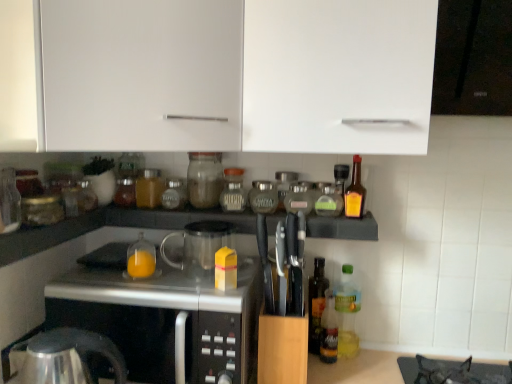
Image resolution: width=512 pixels, height=384 pixels. What do you see at coordinates (174, 195) in the screenshot? I see `translucent glass jar at center, positioned as the 8th bottle in right-to-left order` at bounding box center [174, 195].

The image size is (512, 384). I want to click on clear glass jar at left, positioned as the 2th bottle in left-to-right order, so click(86, 196).

What are the coordinates of `clear plastic bottle at lower right, the 2th bottle viewed from the right` in the screenshot? It's located at (347, 313).

What is the approximate height of white matte cabinet at upper center, the 3th cabinetry in the left-to-right sequence?

white matte cabinet at upper center, the 3th cabinetry in the left-to-right sequence, is 43.09 centimeters tall.

Where is `translucent glass bottle at center, which is counted as the 2th orange juice, starting from the front`? The height and width of the screenshot is (384, 512). translucent glass bottle at center, which is counted as the 2th orange juice, starting from the front is located at coordinates click(x=141, y=264).

Identify the location of translucent glass jar at center, positioned as the 8th bottle in right-to-left order. (174, 195).

Is translucent plastic carton at center, the second orange juice viewed from the back, a part of translucent glass jar at center, the 9th bottle in the right-to-left sequence?

No, translucent plastic carton at center, the second orange juice viewed from the back, is located outside of translucent glass jar at center, the 9th bottle in the right-to-left sequence.

Is translucent glass jar at center, the 9th bottle in the right-to-left sequence, facing away from translucent plastic carton at center, placed as the second orange juice when sorted from left to right?

That's not correct — translucent glass jar at center, the 9th bottle in the right-to-left sequence, is not looking away from translucent plastic carton at center, placed as the second orange juice when sorted from left to right.

Can you see translucent glass jar at center, positioned as the 4th bottle in left-to-right order, touching translucent plastic carton at center, the second orange juice viewed from the back?

There is a gap between translucent glass jar at center, positioned as the 4th bottle in left-to-right order, and translucent plastic carton at center, the second orange juice viewed from the back.

From a real-world perspective, is translucent glass jar at center, the 9th bottle in the right-to-left sequence, above or below translucent plastic carton at center, which appears as the first orange juice when viewed from the right?

In terms of real-world spatial position, translucent glass jar at center, the 9th bottle in the right-to-left sequence, is above translucent plastic carton at center, which appears as the first orange juice when viewed from the right.

From the image's perspective, is translucent glass jar at center, the 9th bottle in the right-to-left sequence, above shiny metallic kettle at lower left?

Yes, from the image's perspective, translucent glass jar at center, the 9th bottle in the right-to-left sequence, is over shiny metallic kettle at lower left.

Does translucent glass jar at center, the 9th bottle in the right-to-left sequence, lie in front of shiny metallic kettle at lower left?

That is False.

From a real-world perspective, which is physically below, translucent glass jar at center, the 9th bottle in the right-to-left sequence, or shiny metallic kettle at lower left?

shiny metallic kettle at lower left.

Does translucent glass jar at center, the 9th bottle in the right-to-left sequence, touch shiny metallic kettle at lower left?

No, translucent glass jar at center, the 9th bottle in the right-to-left sequence, is not touching shiny metallic kettle at lower left.

Choose the correct answer: Is transparent glass jar at center, the seventh bottle when ordered from right to left, inside amber glass bottle at right, which appears as the 1th bottle when viewed from the right, or outside it?

transparent glass jar at center, the seventh bottle when ordered from right to left, is not inside amber glass bottle at right, which appears as the 1th bottle when viewed from the right, it's outside.

Is amber glass bottle at right, arranged as the twelfth bottle when viewed from the left, at the back of transparent glass jar at center, the sixth bottle positioned from the left?

transparent glass jar at center, the sixth bottle positioned from the left, is not turned away from amber glass bottle at right, arranged as the twelfth bottle when viewed from the left.

Which is in front, transparent glass jar at center, the seventh bottle when ordered from right to left, or amber glass bottle at right, which appears as the 1th bottle when viewed from the right?

amber glass bottle at right, which appears as the 1th bottle when viewed from the right, is closer to the camera.

Measure the distance between transparent glass jar at center, the sixth bottle positioned from the left, and amber glass bottle at right, arranged as the twelfth bottle when viewed from the left.

transparent glass jar at center, the sixth bottle positioned from the left, is 15.66 inches away from amber glass bottle at right, arranged as the twelfth bottle when viewed from the left.

Relative to translucent glass bottle at center, the second orange juice when ordered from right to left, is clear plastic bottle at lower right, placed as the 11th bottle when sorted from left to right, in front or behind?

Visually, clear plastic bottle at lower right, placed as the 11th bottle when sorted from left to right, is located behind translucent glass bottle at center, the second orange juice when ordered from right to left.

Between clear plastic bottle at lower right, the 2th bottle viewed from the right, and translucent glass bottle at center, which is counted as the 2th orange juice, starting from the front, which one appears on the left side from the viewer's perspective?

translucent glass bottle at center, which is counted as the 2th orange juice, starting from the front.

Would you consider clear plastic bottle at lower right, placed as the 11th bottle when sorted from left to right, to be distant from translucent glass bottle at center, which is counted as the 2th orange juice, starting from the front?

No.

Would you say clear plastic bottle at lower right, the 2th bottle viewed from the right, is inside or outside transparent glass jar at center, the seventh bottle when ordered from right to left?

clear plastic bottle at lower right, the 2th bottle viewed from the right, lies outside transparent glass jar at center, the seventh bottle when ordered from right to left.

From the image's perspective, who appears lower, clear plastic bottle at lower right, placed as the 11th bottle when sorted from left to right, or transparent glass jar at center, the seventh bottle when ordered from right to left?

clear plastic bottle at lower right, placed as the 11th bottle when sorted from left to right, appears lower in the image.

Can you confirm if clear plastic bottle at lower right, the 2th bottle viewed from the right, is shorter than transparent glass jar at center, the sixth bottle positioned from the left?

No.

Measure the distance from clear plastic bottle at lower right, placed as the 11th bottle when sorted from left to right, to transparent glass jar at center, the sixth bottle positioned from the left.

clear plastic bottle at lower right, placed as the 11th bottle when sorted from left to right, is 19.44 inches away from transparent glass jar at center, the sixth bottle positioned from the left.

Consider the image. From a real-world perspective, which object stands above the other?

From a 3D spatial view, translucent glass bottle at center, acting as the 1th orange juice starting from the left, is above.

Is translucent glass bottle at center, the 1th orange juice positioned from the back, thinner than translucent plastic carton at center, placed as the second orange juice when sorted from left to right?

Incorrect, the width of translucent glass bottle at center, the 1th orange juice positioned from the back, is not less than that of translucent plastic carton at center, placed as the second orange juice when sorted from left to right.

Does translucent glass bottle at center, acting as the 1th orange juice starting from the left, turn towards translucent plastic carton at center, placed as the second orange juice when sorted from left to right?

No.

In the scene shown: From the image's perspective, which is below, translucent glass bottle at center, the 1th orange juice positioned from the back, or translucent plastic carton at center, placed as the second orange juice when sorted from left to right?

From the image's view, translucent plastic carton at center, placed as the second orange juice when sorted from left to right, is below.

From a real-world perspective, is translucent glass bottle at left, which appears as the first bottle when viewed from the left, above or below translucent plastic carton at center, which appears as the first orange juice when viewed from the right?

translucent glass bottle at left, which appears as the first bottle when viewed from the left, is above translucent plastic carton at center, which appears as the first orange juice when viewed from the right.

Which is more to the left, translucent glass bottle at left, which appears as the first bottle when viewed from the left, or translucent plastic carton at center, which appears as the first orange juice when viewed from the right?

translucent glass bottle at left, which appears as the first bottle when viewed from the left, is more to the left.

Based on their sizes in the image, would you say translucent glass bottle at left, which appears as the first bottle when viewed from the left, is bigger or smaller than translucent plastic carton at center, which is the 1th orange juice in front-to-back order?

In the image, translucent glass bottle at left, which appears as the first bottle when viewed from the left, appears to be larger than translucent plastic carton at center, which is the 1th orange juice in front-to-back order.

From a real-world perspective, count 2nd orange juices downward from the translucent glass bottle at left, the 12th bottle viewed from the right, and point to it. Please provide its 2D coordinates.

[(225, 269)]

Locate an element on the screen. bottle that is the 3rd one when counting leftward from the translucent plastic carton at center, the second orange juice viewed from the back is located at coordinates (149, 188).

Locate an element on the screen. The image size is (512, 384). the 7th bottle directly above the shiny metallic kettle at lower left (from a real-world perspective) is located at coordinates (149, 188).

Based on their spatial positions, is translucent glass jar at center, positioned as the 4th bottle in left-to-right order, or white matte cabinet at upper center, which is counted as the third cabinetry, starting from the right, closer to matte glass jar at center, positioned as the sixth bottle in right-to-left order?

Among the two, translucent glass jar at center, positioned as the 4th bottle in left-to-right order, is located nearer to matte glass jar at center, positioned as the sixth bottle in right-to-left order.

Which object lies nearer to the anchor point translucent glass bottle at center, the 1th orange juice positioned from the back, translucent glass jar at center, positioned as the 4th bottle in left-to-right order, or matte glass jar at center, which is the 7th bottle in left-to-right order?

translucent glass jar at center, positioned as the 4th bottle in left-to-right order, is closer to translucent glass bottle at center, the 1th orange juice positioned from the back.

From the picture: Which object lies nearer to the anchor point white matte cabinet at upper center, which appears as the 2th cabinetry when viewed from the left, brown glass jar at center, which is the 3th bottle from left to right, or white matte cabinet at upper center, which ranks as the 1th cabinetry in left-to-right order?

Among the two, white matte cabinet at upper center, which ranks as the 1th cabinetry in left-to-right order, is located nearer to white matte cabinet at upper center, which appears as the 2th cabinetry when viewed from the left.

From the image, which object appears to be farther from translucent plastic carton at center, placed as the second orange juice when sorted from left to right, translucent glass bottle at center, the 1th orange juice positioned from the back, or brown glass jar at center, which is the 3th bottle from left to right?

Among the two, brown glass jar at center, which is the 3th bottle from left to right, is located further to translucent plastic carton at center, placed as the second orange juice when sorted from left to right.

When comparing their distances from brown glass jar at center, which is the 3th bottle from left to right, does shiny metallic kettle at lower left or clear glass jar at left, the 11th bottle positioned from the right, seem further?

shiny metallic kettle at lower left is further to brown glass jar at center, which is the 3th bottle from left to right.

Estimate the real-world distances between objects in this image. Which object is further from matte glass jar at center, positioned as the sixth bottle in right-to-left order, translucent glass bottle at left, the 12th bottle viewed from the right, or satin silver microwave at center?

Based on the image, translucent glass bottle at left, the 12th bottle viewed from the right, appears to be further to matte glass jar at center, positioned as the sixth bottle in right-to-left order.

Estimate the real-world distances between objects in this image. Which object is further from clear glass jar at left, positioned as the 2th bottle in left-to-right order, white matte cabinet at upper center, which is the second cabinetry from right to left, or translucent glass jar at center, positioned as the 4th bottle in left-to-right order?

white matte cabinet at upper center, which is the second cabinetry from right to left, is further to clear glass jar at left, positioned as the 2th bottle in left-to-right order.

Based on the photo, looking at the image, which one is located further to shiny metallic kettle at lower left, brown glass jar at center, which is the 3th bottle from left to right, or clear plastic bottle at lower right, the 2th bottle viewed from the right?

Based on the image, clear plastic bottle at lower right, the 2th bottle viewed from the right, appears to be further to shiny metallic kettle at lower left.

Identify the location of oven located between translucent glass jar at center, the 9th bottle in the right-to-left sequence, and clear plastic bottle at lower right, placed as the 11th bottle when sorted from left to right, in the left-right direction. Image resolution: width=512 pixels, height=384 pixels. (165, 320).

This screenshot has width=512, height=384. Find the location of `oven between translucent glass bottle at left, which appears as the first bottle when viewed from the left, and translucent plastic bottle at lower right, positioned as the tenth bottle in left-to-right order`. oven between translucent glass bottle at left, which appears as the first bottle when viewed from the left, and translucent plastic bottle at lower right, positioned as the tenth bottle in left-to-right order is located at coordinates (165, 320).

This screenshot has width=512, height=384. What are the coordinates of `cabinetry between white matte cabinet at upper center, the 3th cabinetry in the left-to-right sequence, and clear plastic bottle at lower right, the 2th bottle viewed from the right, in the vertical direction` in the screenshot? It's located at (238, 74).

You are a GUI agent. You are given a task and a screenshot of the screen. Output one action in this format:
    pyautogui.click(x=<x>, y=<y>)
    Task: Click on the orange juice between white matte cabinet at upper center, which appears as the 2th cabinetry when viewed from the left, and translucent glass bottle at center, acting as the 1th orange juice starting from the left, in the front-back direction
    This screenshot has height=384, width=512.
    Given the screenshot: What is the action you would take?
    [x=225, y=269]